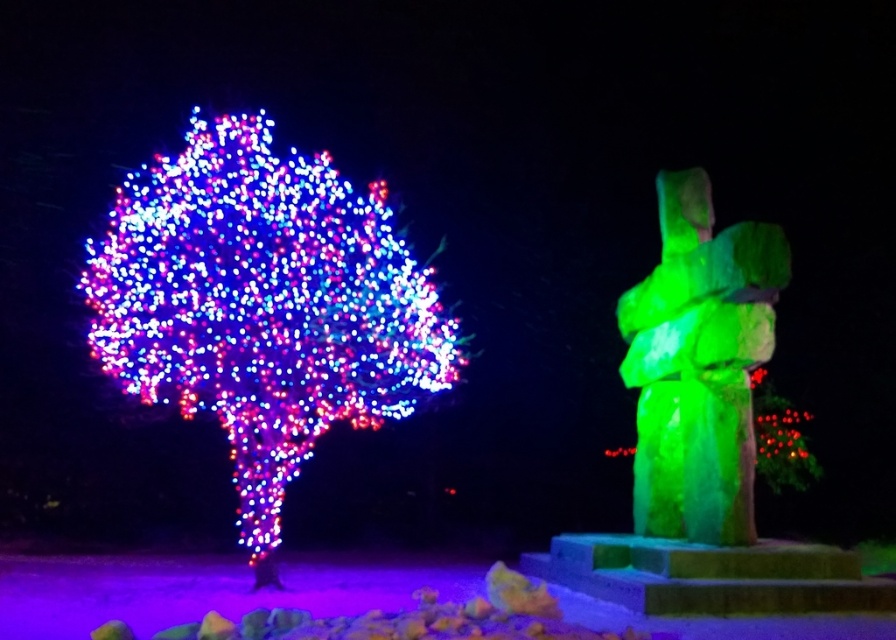
You are standing at the camera position and want to take a photo of the illuminated plastic tree at left. If your camera has a maximum focus range of 30 feet, will you be able to capture the tree clearly?

The illuminated plastic tree at left is 31.69 feet away from the camera, which exceeds the maximum focus range of 30 feet. Therefore, the camera cannot focus on the tree clearly.

You are standing at the center of the scene and want to locate the illuminated plastic tree at left. According to the coordinates provided, in which direction should you look to find it?

The illuminated plastic tree at left is located at coordinates point (263, 304). Since you are at the center, you should look to the left side to find it.

You are a photographer setting up a tripod in the middle of the scene. You want to capture both the illuminated plastic tree at left and the green stone statue at right in your shot. Which object will appear taller in the photograph?

The illuminated plastic tree at left will appear taller in the photograph because it has a greater height compared to the green stone statue at right.